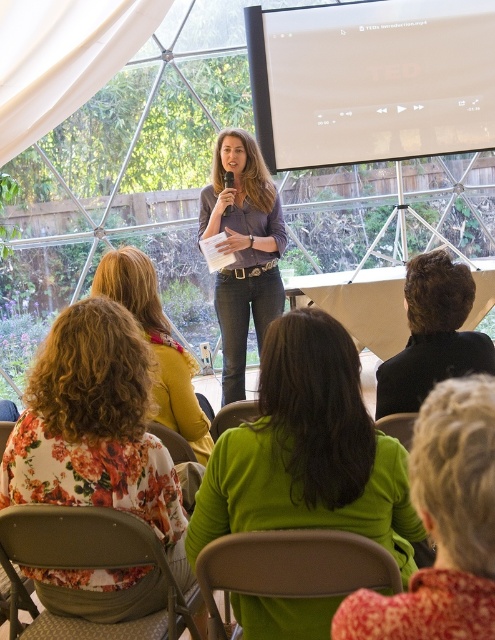
Is white matte projection screen at upper center positioned at the back of green matte sweater at center?

Yes, white matte projection screen at upper center is further from the viewer.

Which of these two, white matte projection screen at upper center or green matte sweater at center, stands taller?

white matte projection screen at upper center is taller.

The image size is (495, 640). In order to click on white matte projection screen at upper center in this screenshot , I will do `click(372, 81)`.

I want to click on white matte projection screen at upper center, so click(372, 81).

Is point (261, 189) closer to viewer compared to point (195, 442)?

No, (261, 189) is further to viewer.

How distant is matte purple shirt at center from floral fabric dress at left?

The distance of matte purple shirt at center from floral fabric dress at left is 4.77 feet.

At what (x,y) coordinates should I click in order to perform the action: click on matte purple shirt at center. Please return your answer as a coordinate pair (x, y). This screenshot has width=495, height=640. Looking at the image, I should click on (243, 250).

At what (x,y) coordinates should I click in order to perform the action: click on matte purple shirt at center. Please return your answer as a coordinate pair (x, y). The width and height of the screenshot is (495, 640). Looking at the image, I should click on (243, 250).

Who is positioned more to the right, green fabric at center or matte purple shirt at center?

green fabric at center

Based on the photo, is green fabric at center above matte purple shirt at center?

Incorrect, green fabric at center is not positioned above matte purple shirt at center.

Where is `green fabric at center`? The image size is (495, 640). green fabric at center is located at coordinates (443, 525).